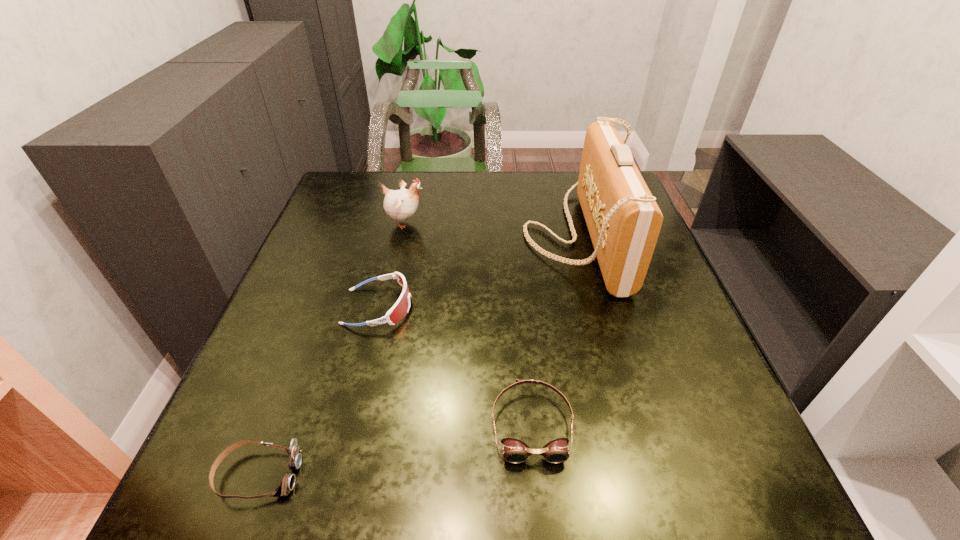
The width and height of the screenshot is (960, 540). I want to click on free location at the near right corner, so click(765, 502).

The image size is (960, 540). What are the coordinates of `free space between the fourth shortest object and the handbag` in the screenshot? It's located at (491, 229).

Identify the location of vacant area between the fourth shortest object and the tallest object. (491, 229).

The height and width of the screenshot is (540, 960). I want to click on empty location between the handbag and the farthest goggles, so click(x=477, y=271).

Image resolution: width=960 pixels, height=540 pixels. Find the location of `free space that is in between the farthest goggles and the handbag`. free space that is in between the farthest goggles and the handbag is located at coordinates (477, 271).

Where is `free spot between the bird and the tallest goggles`? This screenshot has height=540, width=960. free spot between the bird and the tallest goggles is located at coordinates (392, 265).

Identify the location of vacant area between the tallest object and the rightmost goggles. (x=554, y=330).

This screenshot has width=960, height=540. I want to click on object that is the closest to the handbag, so click(x=515, y=451).

Locate an element on the screen. object that stands as the third closest to the handbag is located at coordinates (399, 310).

Where is `goggles that is the second closest one to the tallest object`? goggles that is the second closest one to the tallest object is located at coordinates (399, 310).